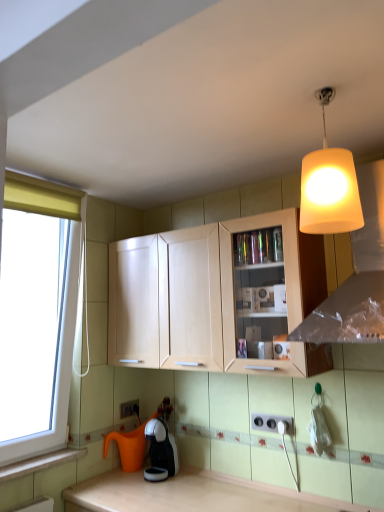
Image resolution: width=384 pixels, height=512 pixels. In order to click on vacant point above matte white lampshade at upper right (from a real-world perspective) in this screenshot , I will do `click(326, 92)`.